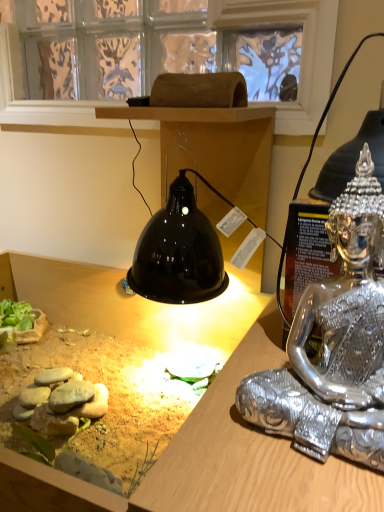
Identify the location of matte black lamp at upper center. (211, 458).

Measure the distance between transparent glass window screen at upper center and camera.

transparent glass window screen at upper center is 38.72 inches away from camera.

The height and width of the screenshot is (512, 384). In order to click on silver metallic statue at right in this screenshot , I will do `click(335, 343)`.

Visually, is matte black lamp at upper center positioned to the left or to the right of silver metallic statue at right?

In the image, matte black lamp at upper center appears on the left side of silver metallic statue at right.

This screenshot has width=384, height=512. Identify the location of desk lying below the silver metallic statue at right (from the image's perspective). (211, 458).

Are matte black lamp at upper center and silver metallic statue at right far apart?

No.

Measure the distance from matte black lamp at upper center to silver metallic statue at right.

matte black lamp at upper center and silver metallic statue at right are 22.90 inches apart from each other.

Which of these two, silver metallic statue at right or transparent glass window screen at upper center, is bigger?

With larger size is transparent glass window screen at upper center.

Do you think silver metallic statue at right is within transparent glass window screen at upper center, or outside of it?

silver metallic statue at right cannot be found inside transparent glass window screen at upper center.

Find the location of a particular element. This screenshot has width=384, height=512. window screen above the silver metallic statue at right (from the image's perspective) is located at coordinates (302, 49).

Is silver metallic statue at right in front of or behind matte black lamp at upper center in the image?

Visually, silver metallic statue at right is located behind matte black lamp at upper center.

Is silver metallic statue at right not within matte black lamp at upper center?

That's correct, silver metallic statue at right is outside of matte black lamp at upper center.

Considering the relative sizes of silver metallic statue at right and matte black lamp at upper center in the image provided, is silver metallic statue at right smaller than matte black lamp at upper center?

Yes.

How different are the orientations of silver metallic statue at right and matte black lamp at upper center in degrees?

They differ by 1.32 degrees in their facing directions.

Is matte black lamp at upper center bigger or smaller than transparent glass window screen at upper center?

In the image, matte black lamp at upper center appears to be larger than transparent glass window screen at upper center.

Is transparent glass window screen at upper center completely or partially inside matte black lamp at upper center?

No, transparent glass window screen at upper center is not surrounded by matte black lamp at upper center.

Between matte black lamp at upper center and transparent glass window screen at upper center, which one has larger width?

matte black lamp at upper center.

Considering their positions, is matte black lamp at upper center located in front of or behind transparent glass window screen at upper center?

In the image, matte black lamp at upper center appears in front of transparent glass window screen at upper center.

Choose the correct answer: Is transparent glass window screen at upper center inside silver metallic statue at right or outside it?

transparent glass window screen at upper center is spatially situated outside silver metallic statue at right.

Which object is positioned more to the right, transparent glass window screen at upper center or silver metallic statue at right?

silver metallic statue at right.

You are a GUI agent. You are given a task and a screenshot of the screen. Output one action in this format:
    pyautogui.click(x=<x>, y=<y>)
    Task: Click on the person in front of the transparent glass window screen at upper center
    
    Given the screenshot: What is the action you would take?
    pyautogui.click(x=335, y=343)

Does transparent glass window screen at upper center come in front of silver metallic statue at right?

No, it is behind silver metallic statue at right.

From the image's perspective, which one is positioned lower, transparent glass window screen at upper center or matte black lamp at upper center?

matte black lamp at upper center, from the image's perspective.

In the scene shown: Is transparent glass window screen at upper center to the right of matte black lamp at upper center from the viewer's perspective?

Yes, transparent glass window screen at upper center is to the right of matte black lamp at upper center.

The width and height of the screenshot is (384, 512). In order to click on window screen behind the matte black lamp at upper center in this screenshot , I will do `click(302, 49)`.

Is transparent glass window screen at upper center completely or partially outside of matte black lamp at upper center?

transparent glass window screen at upper center lies outside matte black lamp at upper center's area.

Identify the location of person behind the matte black lamp at upper center. (335, 343).

This screenshot has height=512, width=384. Find the location of `person below the transparent glass window screen at upper center (from a real-world perspective)`. person below the transparent glass window screen at upper center (from a real-world perspective) is located at coordinates (335, 343).

Estimate the real-world distances between objects in this image. Which object is further from silver metallic statue at right, matte black lamp at upper center or transparent glass window screen at upper center?

Among the two, transparent glass window screen at upper center is located further to silver metallic statue at right.

Estimate the real-world distances between objects in this image. Which object is further from transparent glass window screen at upper center, matte black lamp at upper center or silver metallic statue at right?

silver metallic statue at right lies further to transparent glass window screen at upper center than the other object.

Looking at this image, when comparing their distances from silver metallic statue at right, does transparent glass window screen at upper center or matte black lamp at upper center seem further?

transparent glass window screen at upper center.

When comparing their distances from matte black lamp at upper center, does silver metallic statue at right or transparent glass window screen at upper center seem further?

silver metallic statue at right is positioned further to the anchor matte black lamp at upper center.

In the scene shown: From the image, which object appears to be farther from transparent glass window screen at upper center, silver metallic statue at right or matte black lamp at upper center?

Among the two, silver metallic statue at right is located further to transparent glass window screen at upper center.

Considering their positions, is transparent glass window screen at upper center positioned closer to matte black lamp at upper center than silver metallic statue at right?

transparent glass window screen at upper center is positioned closer to the anchor matte black lamp at upper center.

At what (x,y) coordinates should I click in order to perform the action: click on person between transparent glass window screen at upper center and matte black lamp at upper center in the vertical direction. Please return your answer as a coordinate pair (x, y). Looking at the image, I should click on (335, 343).